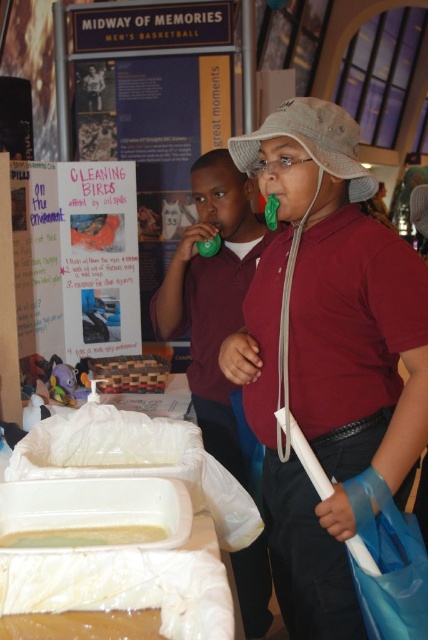
You are at an event and see the matte green whistle at center and the translucent plastic container at center. Which object is located to the right of the other?

The matte green whistle at center is positioned on the right side of the translucent plastic container at center.